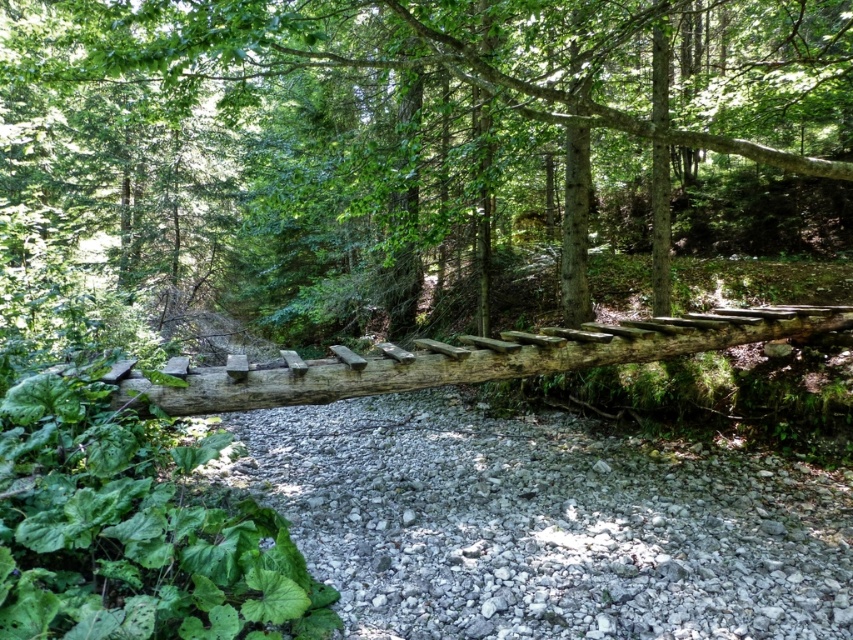
You are a hiker trying to cross the stream using the bridge made of the smooth brown log at center and gray gravel at center. Which part of the bridge should you step on to avoid slipping?

The smooth brown log at center is bigger than gray gravel at center, so stepping on the smooth brown log at center provides a larger surface area and better stability, reducing the chance of slipping.

You are a hiker who wants to cross the stream using the bridge. The smooth brown log at center is the bridge. There is gray gravel at center in the stream. Which object is closer to you as you stand on the bridge?

The smooth brown log at center is closer to the viewer than the gray gravel at center, so the log is closer when standing on the bridge.